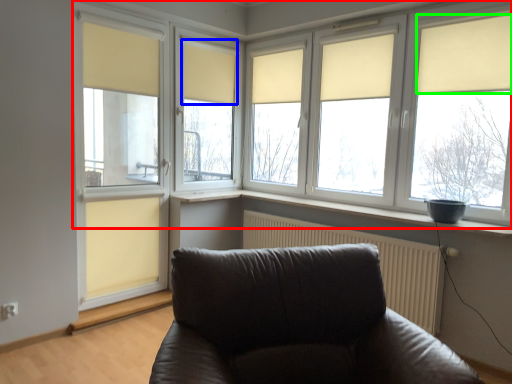
Question: Considering the real-world distances, which object is farthest from window (highlighted by a red box)? curtain (highlighted by a blue box) or curtain (highlighted by a green box)?

Choices:
 (A) curtain
 (B) curtain

Answer: (A)